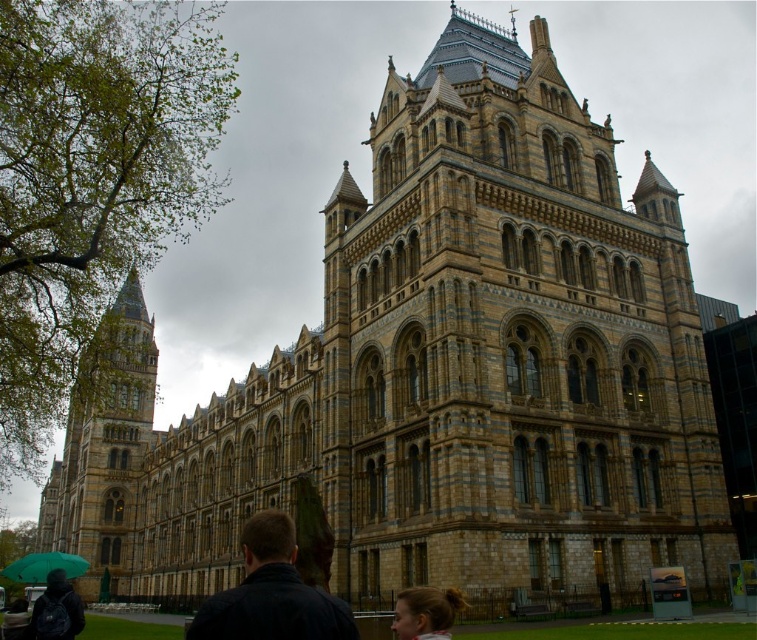
Who is positioned more to the left, dark blue jacket at lower center or green matte umbrella at lower left?

green matte umbrella at lower left

Between point (257, 634) and point (83, 561), which one is positioned in front?

Point (257, 634) is more forward.

Between point (282, 540) and point (36, 561), which one is positioned in front?

Point (282, 540) is more forward.

Find the location of a particular element. This screenshot has height=640, width=757. dark blue jacket at lower center is located at coordinates (270, 593).

Is point (103, 525) positioned before point (48, 589)?

No, (103, 525) is behind (48, 589).

Is brown stone tower at left further to camera compared to dark blue backpack at lower left?

Yes, brown stone tower at left is behind dark blue backpack at lower left.

Consider the image. Measure the distance between brown stone tower at left and camera.

brown stone tower at left is 240.56 feet away from camera.

You are a GUI agent. You are given a task and a screenshot of the screen. Output one action in this format:
    pyautogui.click(x=<x>, y=<y>)
    Task: Click on the brown stone tower at left
    This screenshot has height=640, width=757.
    Given the screenshot: What is the action you would take?
    pyautogui.click(x=104, y=445)

Is dark blue jacket at lower center in front of dark blue backpack at lower left?

Yes, dark blue jacket at lower center is closer to the viewer.

Who is more forward, [279,596] or [64,592]?

Point [279,596] is more forward.

Image resolution: width=757 pixels, height=640 pixels. I want to click on dark blue jacket at lower center, so click(270, 593).